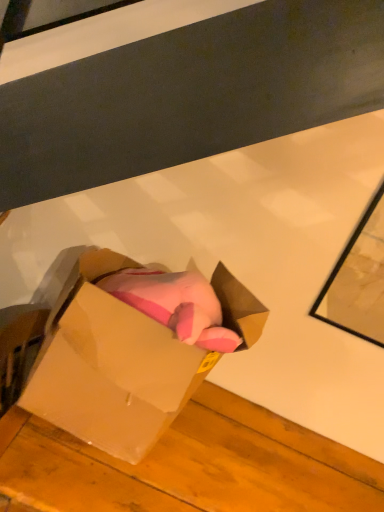
Question: Should I look upward or downward to see matte cardboard box at center?

Choices:
 (A) down
 (B) up

Answer: (A)